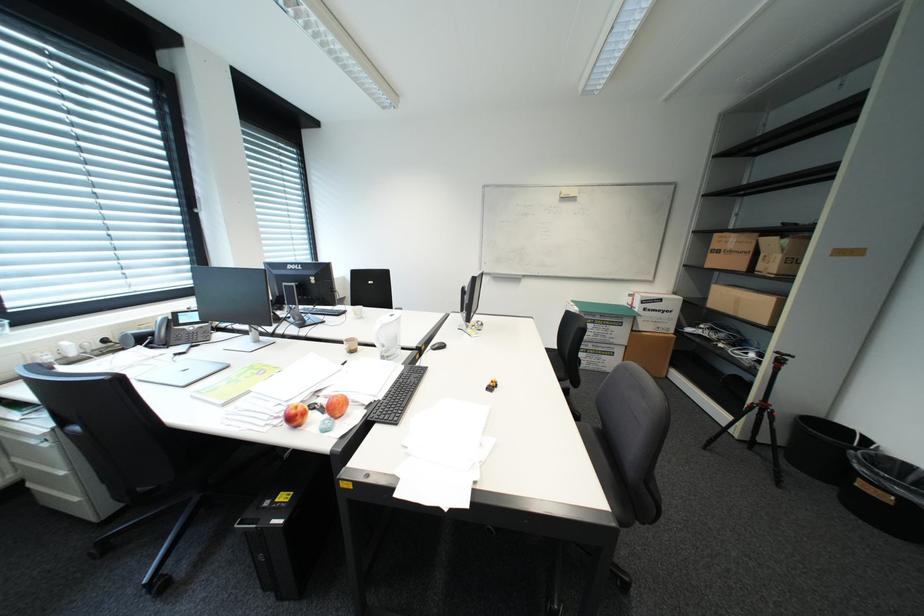
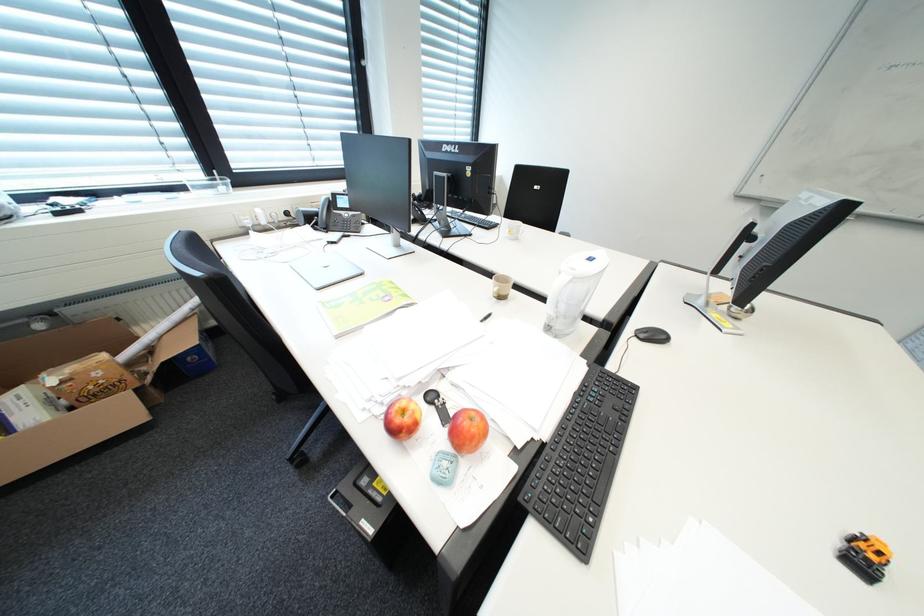
First-person continuous shooting, in which direction is the camera rotating?

The camera rotated toward left-down.